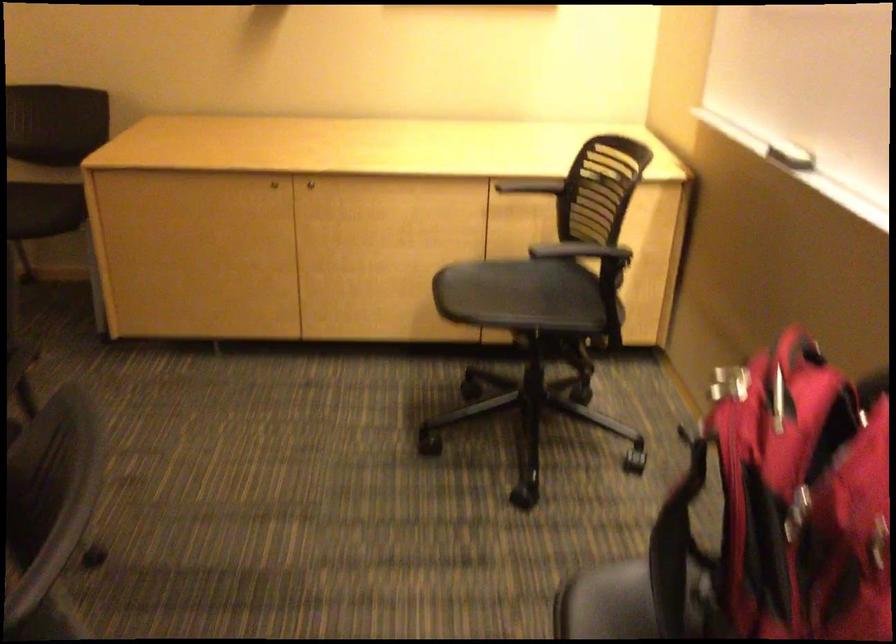
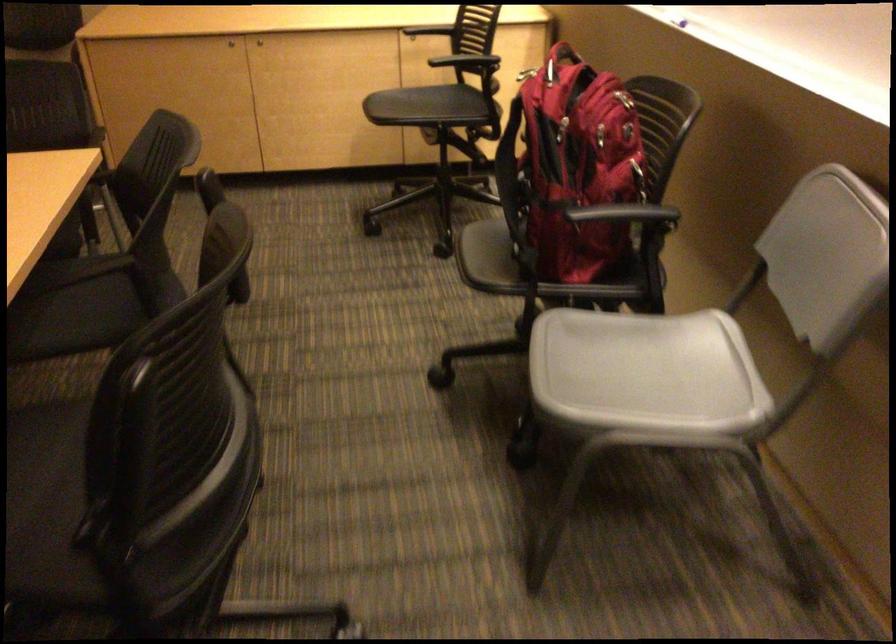
In the second image, find the point that corresponds to (279,196) in the first image.

(230, 44)